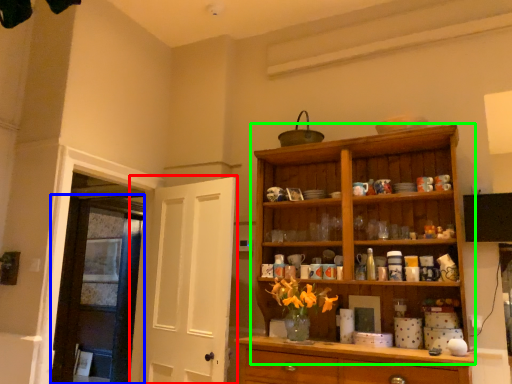
Question: Considering the real-world distances, which object is closest to door (highlighted by a red box)? door (highlighted by a blue box) or cupboard (highlighted by a green box).

Choices:
 (A) door
 (B) cupboard

Answer: (A)